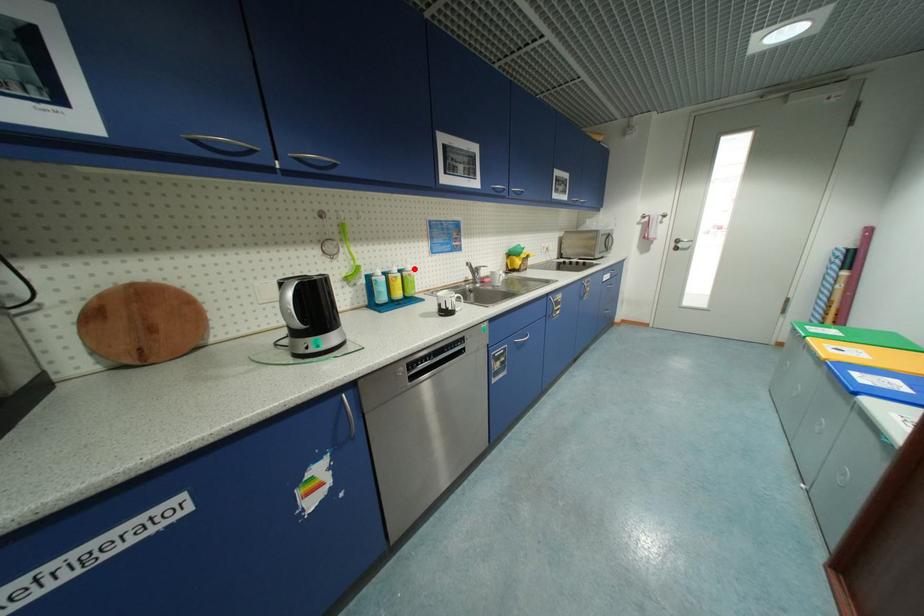
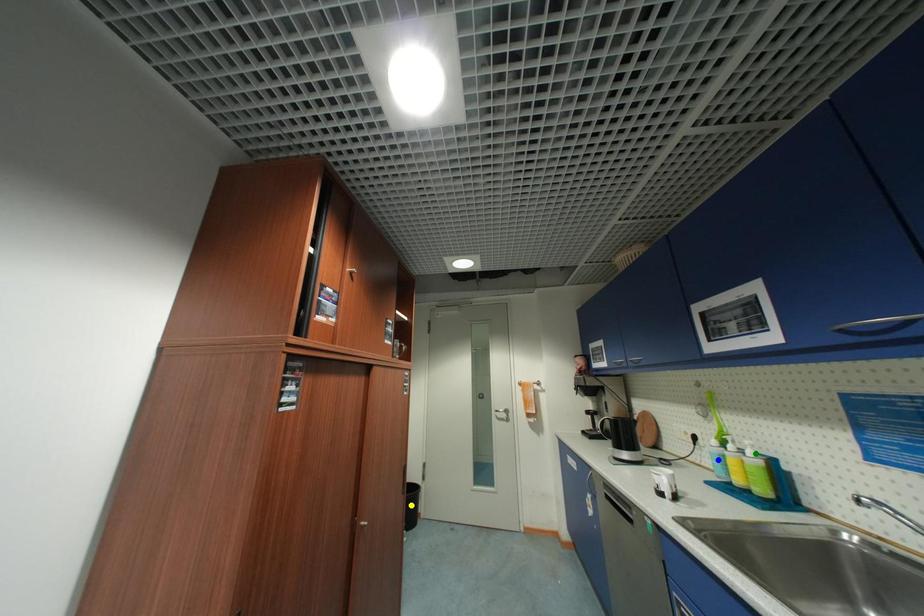
Question: I am providing you with two images of the same scene from different viewpoints. A red point is marked on the first image. You are given multiple points on the second image. Which point in image 2 is actually the same real-world point as the red point in image 1?

Choices:
 (A) green point
 (B) blue point
 (C) yellow point

Answer: (A)